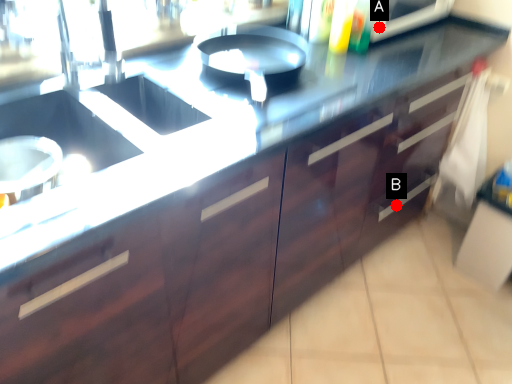
Question: Two points are circled on the image, labeled by A and B beside each circle. Which of the following is the farthest from the observer?

Choices:
 (A) A is further
 (B) B is further

Answer: (B)